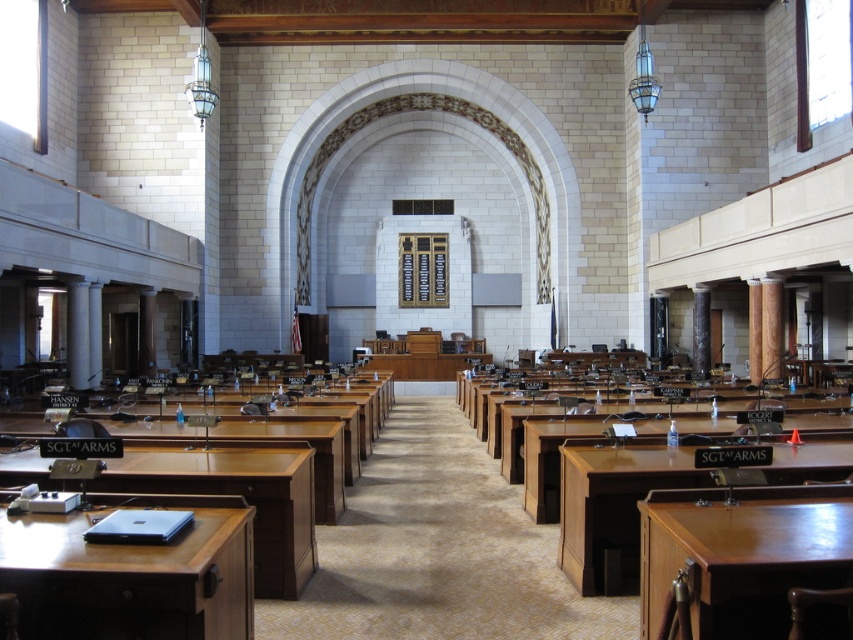
Based on the photo, is brown wood table at lower left below wooden desk at center?

Yes, brown wood table at lower left is below wooden desk at center.

Who is more distant from viewer, (186,454) or (341,493)?

The point (341,493) is behind.

Identify the location of brown wood table at lower left. (236, 493).

Is mahogany wood table at lower right positioned in front of brown wood table at lower left?

Yes.

Is point (670, 580) farther from viewer compared to point (310, 528)?

No, (670, 580) is in front of (310, 528).

Locate an element on the screen. The height and width of the screenshot is (640, 853). mahogany wood table at lower right is located at coordinates point(740,557).

Is mahogany wood table at lower right behind wooden desk at center?

No, it is not.

Who is shorter, mahogany wood table at lower right or wooden desk at center?

With less height is mahogany wood table at lower right.

The image size is (853, 640). What do you see at coordinates (740, 557) in the screenshot?
I see `mahogany wood table at lower right` at bounding box center [740, 557].

You are a GUI agent. You are given a task and a screenshot of the screen. Output one action in this format:
    pyautogui.click(x=<x>, y=<y>)
    Task: Click on the mahogany wood table at lower right
    
    Given the screenshot: What is the action you would take?
    pyautogui.click(x=740, y=557)